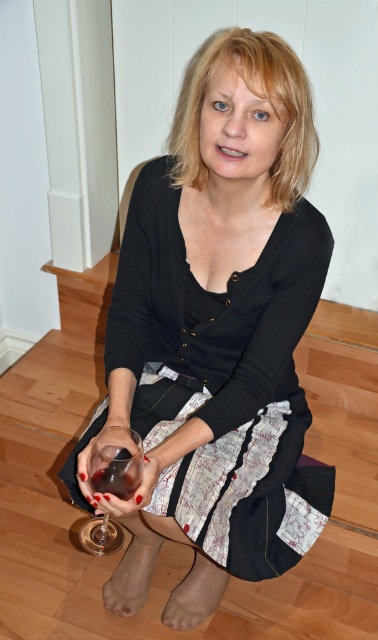
Is matte black dress at center shorter than transparent glass at lower center?

Incorrect, matte black dress at center's height does not fall short of transparent glass at lower center's.

Is point (263, 378) closer to camera compared to point (108, 515)?

Yes, it is in front of point (108, 515).

You are a GUI agent. You are given a task and a screenshot of the screen. Output one action in this format:
    pyautogui.click(x=<x>, y=<y>)
    Task: Click on the matte black dress at center
    The height and width of the screenshot is (640, 378).
    Given the screenshot: What is the action you would take?
    pyautogui.click(x=216, y=333)

Does matte black dress at center have a lesser height compared to translucent glass at lower left?

No.

Describe the element at coordinates (216, 333) in the screenshot. I see `matte black dress at center` at that location.

You are a GUI agent. You are given a task and a screenshot of the screen. Output one action in this format:
    pyautogui.click(x=<x>, y=<y>)
    Task: Click on the matte black dress at center
    The width and height of the screenshot is (378, 640).
    Given the screenshot: What is the action you would take?
    (x=216, y=333)

How far apart are transparent glass at lower center and translucent glass at lower left?

The distance of transparent glass at lower center from translucent glass at lower left is 0.65 inches.

Between point (108, 474) and point (123, 467), which one is positioned behind?

Positioned behind is point (108, 474).

Is point (111, 454) less distant than point (122, 476)?

No, it is not.

Where is `transparent glass at lower center`? Image resolution: width=378 pixels, height=640 pixels. transparent glass at lower center is located at coordinates (116, 461).